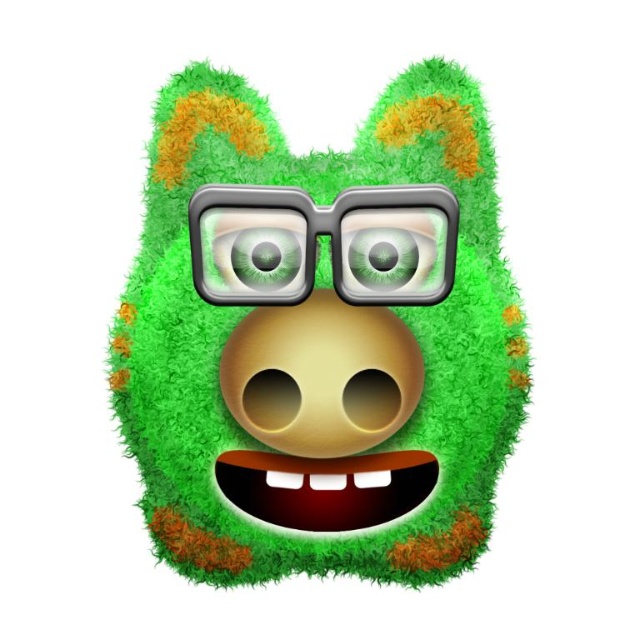
Which is in front, point (451, 545) or point (244, 260)?

Point (244, 260) is in front.

Who is more distant from viewer, (352, 484) or (264, 186)?

The point (352, 484) is behind.

I want to click on fuzzy green creature at center, so pyautogui.click(x=317, y=344).

Is fuzzy green creature at center thinner than green glossy eye at center?

No, fuzzy green creature at center is not thinner than green glossy eye at center.

Who is more forward, (509,301) or (244,243)?

Positioned in front is point (244,243).

This screenshot has height=640, width=640. Identify the location of fuzzy green creature at center. (317, 344).

Is gold matte/natural nose at center closer to camera compared to green matte eye at center?

No, it is behind green matte eye at center.

Is the position of gold matte/natural nose at center more distant than that of green matte eye at center?

Yes, it is behind green matte eye at center.

Does point (336, 400) lie in front of point (349, 259)?

No, it is not.

Identify the location of gold matte/natural nose at center. (321, 376).